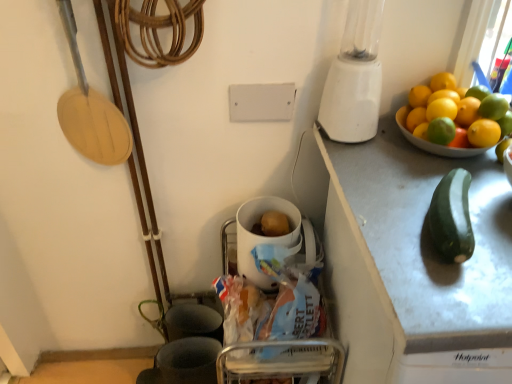
The image size is (512, 384). What are the coordinates of `free space in front of yellow matte lemon at right, the second lemon from the bottom` in the screenshot? It's located at (475, 205).